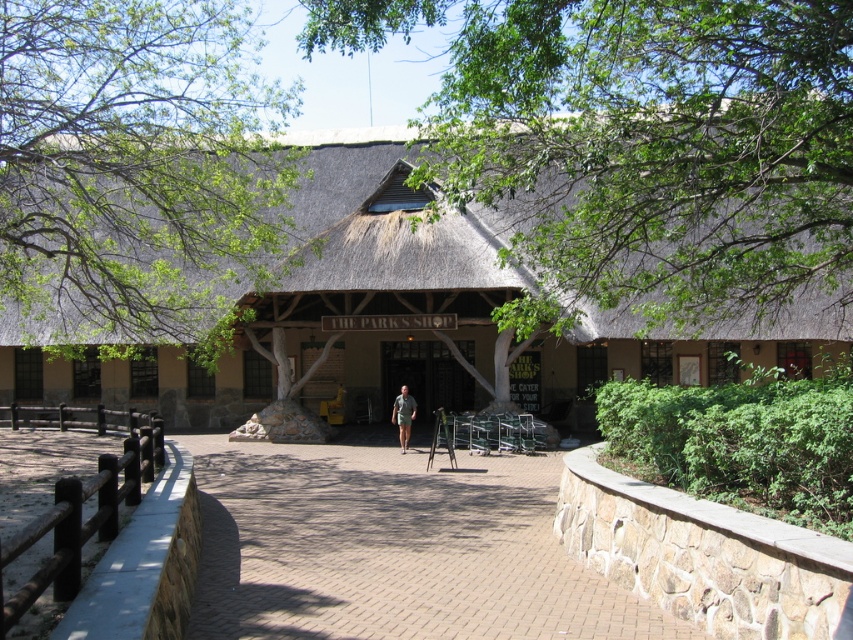
Which is below, green leafy tree at upper center or brown brick path at center?

brown brick path at center is below.

In the scene shown: Is green leafy tree at upper center smaller than brown brick path at center?

Incorrect, green leafy tree at upper center is not smaller in size than brown brick path at center.

Is point (485, 48) farther from viewer compared to point (566, 586)?

Yes, point (485, 48) is behind point (566, 586).

You are a GUI agent. You are given a task and a screenshot of the screen. Output one action in this format:
    pyautogui.click(x=<x>, y=<y>)
    Task: Click on the green leafy tree at upper center
    
    Given the screenshot: What is the action you would take?
    pyautogui.click(x=656, y=147)

Who is more forward, (424, 492) or (412, 417)?

Point (424, 492) is in front.

Who is higher up, brown brick path at center or camouflage fabric shirt at center?

Positioned higher is camouflage fabric shirt at center.

Is point (299, 512) behind point (409, 435)?

No, it is in front of (409, 435).

In order to click on brown brick path at center in this screenshot , I will do `click(392, 548)`.

Is green leafy tree at upper center shorter than brown thatch hut at center?

Yes, green leafy tree at upper center is shorter than brown thatch hut at center.

Is point (653, 196) closer to viewer compared to point (364, 161)?

Yes, point (653, 196) is closer to viewer.

Identify the location of green leafy tree at upper center. This screenshot has height=640, width=853. (656, 147).